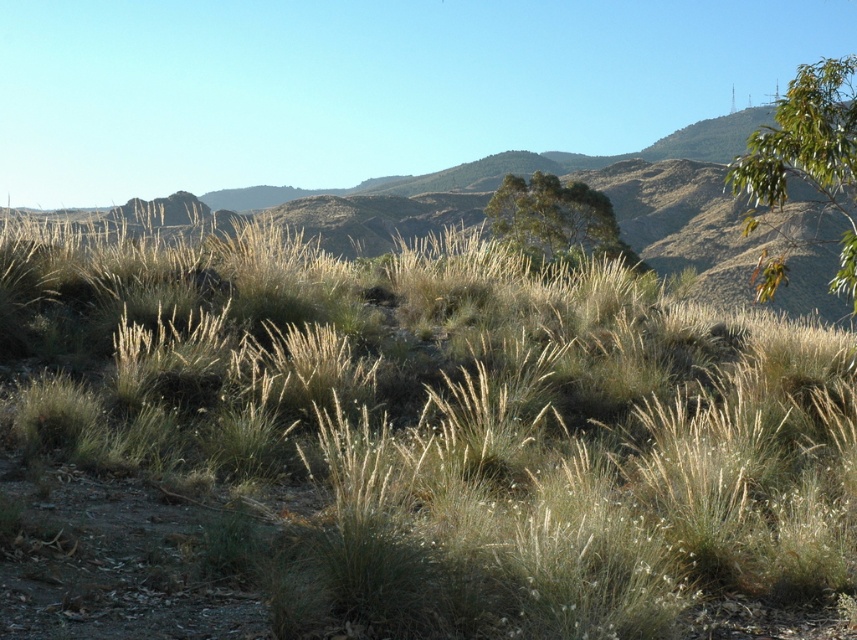
Question: Does dry grass at center appear on the right side of green leafy tree at upper right?

Choices:
 (A) no
 (B) yes

Answer: (A)

Question: Does dry grass at center appear on the right side of green leafy tree at upper center?

Choices:
 (A) yes
 (B) no

Answer: (B)

Question: Which of these objects is positioned closest to the green leafy tree at upper right?

Choices:
 (A) green leafy tree at upper center
 (B) dry grass at center

Answer: (B)

Question: Among these objects, which one is farthest from the camera?

Choices:
 (A) dry grass at center
 (B) green leafy tree at upper center

Answer: (B)

Question: From the image, what is the correct spatial relationship of dry grass at center in relation to green leafy tree at upper right?

Choices:
 (A) below
 (B) above

Answer: (A)

Question: Which object is the closest to the green leafy tree at upper center?

Choices:
 (A) dry grass at center
 (B) green leafy tree at upper right

Answer: (B)